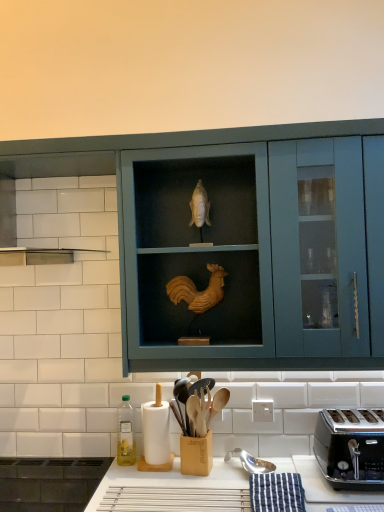
Question: Can you confirm if green glass bottle at lower left is thinner than black metallic toaster at lower right?

Choices:
 (A) no
 (B) yes

Answer: (B)

Question: Considering the relative positions of green glass bottle at lower left and black metallic toaster at lower right in the image provided, is green glass bottle at lower left to the right of black metallic toaster at lower right from the viewer's perspective?

Choices:
 (A) yes
 (B) no

Answer: (B)

Question: Does green glass bottle at lower left turn towards black metallic toaster at lower right?

Choices:
 (A) yes
 (B) no

Answer: (B)

Question: Are green glass bottle at lower left and black metallic toaster at lower right located far from each other?

Choices:
 (A) no
 (B) yes

Answer: (A)

Question: From a real-world perspective, is green glass bottle at lower left beneath black metallic toaster at lower right?

Choices:
 (A) yes
 (B) no

Answer: (B)

Question: Choose the correct answer: Is white matte paper towel at lower left inside black metallic toaster at lower right or outside it?

Choices:
 (A) inside
 (B) outside

Answer: (B)

Question: Is white matte paper towel at lower left to the left or to the right of black metallic toaster at lower right in the image?

Choices:
 (A) left
 (B) right

Answer: (A)

Question: Looking at the image, does white matte paper towel at lower left seem bigger or smaller compared to black metallic toaster at lower right?

Choices:
 (A) big
 (B) small

Answer: (B)

Question: Considering the positions of white matte paper towel at lower left and black metallic toaster at lower right in the image, is white matte paper towel at lower left wider or thinner than black metallic toaster at lower right?

Choices:
 (A) thin
 (B) wide

Answer: (A)

Question: From the image's perspective, relative to green glass bottle at lower left, is white matte paper towel at lower left above or below?

Choices:
 (A) below
 (B) above

Answer: (B)

Question: In terms of width, does white matte paper towel at lower left look wider or thinner when compared to green glass bottle at lower left?

Choices:
 (A) thin
 (B) wide

Answer: (B)

Question: Is white matte paper towel at lower left bigger or smaller than green glass bottle at lower left?

Choices:
 (A) big
 (B) small

Answer: (A)

Question: From a real-world perspective, is white matte paper towel at lower left physically located above or below green glass bottle at lower left?

Choices:
 (A) above
 (B) below

Answer: (A)

Question: Considering the relative positions of black metallic toaster at lower right and white matte paper towel at lower left in the image provided, is black metallic toaster at lower right to the left or to the right of white matte paper towel at lower left?

Choices:
 (A) left
 (B) right

Answer: (B)

Question: From the image's perspective, is black metallic toaster at lower right above or below white matte paper towel at lower left?

Choices:
 (A) above
 (B) below

Answer: (B)